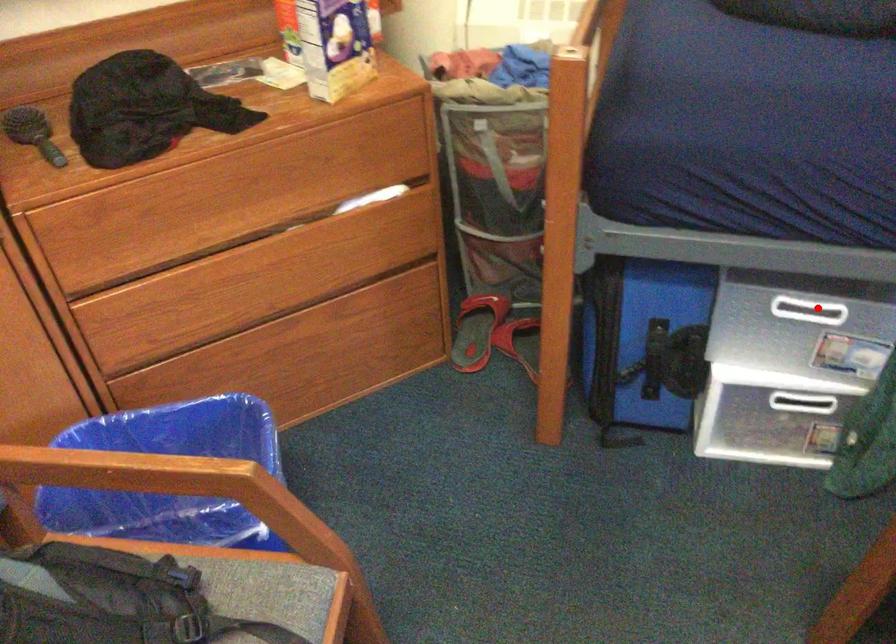
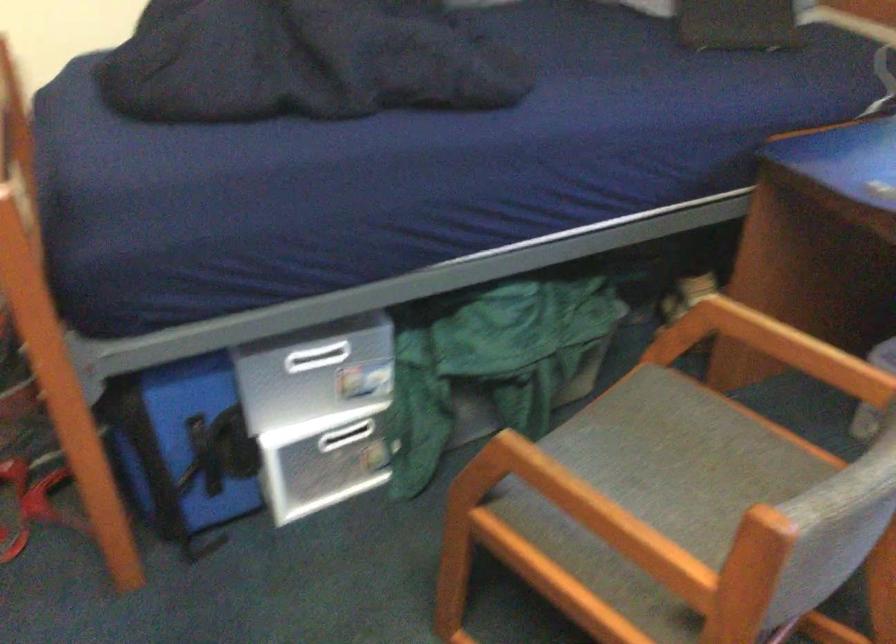
Question: A red point is marked in image1. In image2, is the corresponding 3D point closer to the camera or farther? Reply with the corresponding letter.

Choices:
 (A) The corresponding 3D point is closer.
 (B) The corresponding 3D point is farther.

Answer: (B)